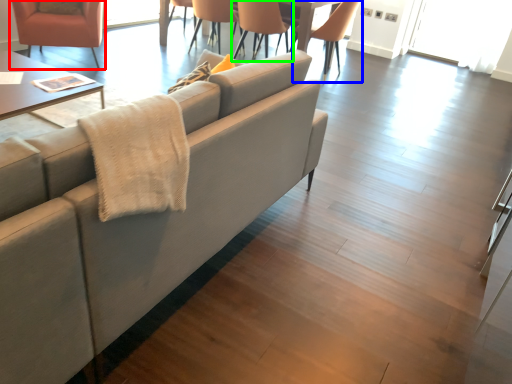
Question: Considering the real-world distances, which object is farthest from chair (highlighted by a red box)? chair (highlighted by a blue box) or chair (highlighted by a green box)?

Choices:
 (A) chair
 (B) chair

Answer: (A)